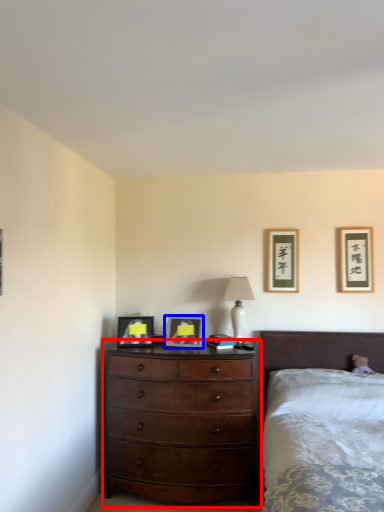
Question: Among these objects, which one is nearest to the camera, chest of drawers (highlighted by a red box) or picture frame (highlighted by a blue box)?

Choices:
 (A) chest of drawers
 (B) picture frame

Answer: (A)